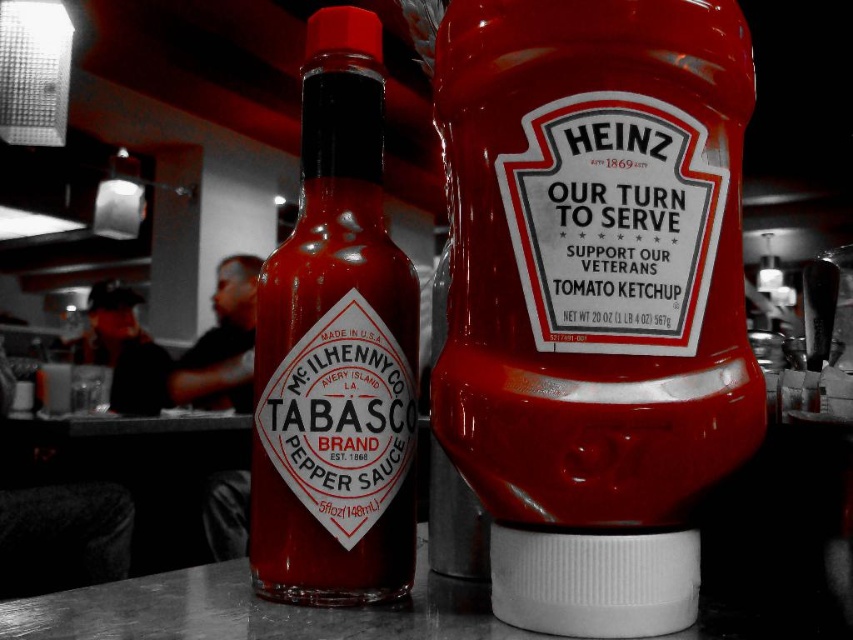
Consider the image. You are a food service worker who needs to place both the glossy plastic bottle at center and the matte glass tabasco pepper sauce at center on a shelf that can only hold items up to 10 inches in width. Based on the description, can you determine if both items will fit on the shelf together?

The glossy plastic bottle at center might be wider than matte glass tabasco pepper sauce at center, so it is uncertain if both will fit on the shelf together without exceeding the 10 inches width limit. Check their exact measurements before placing them.

What are the coordinates of the glossy plastic bottle at center?

The glossy plastic bottle at center is located at coordinates point (595, 257).

You are a delivery person standing at the entrance of a restaurant. You need to place a new glossy plastic bottle at center on the counter. The counter is 3 feet away from you. Can you reach it without moving your feet?

The glossy plastic bottle at center and viewer are 16.98 inches apart. Since the counter is 3 feet away, which is 36 inches, you are farther away than the required distance. Therefore, you cannot reach the glossy plastic bottle at center without moving your feet.